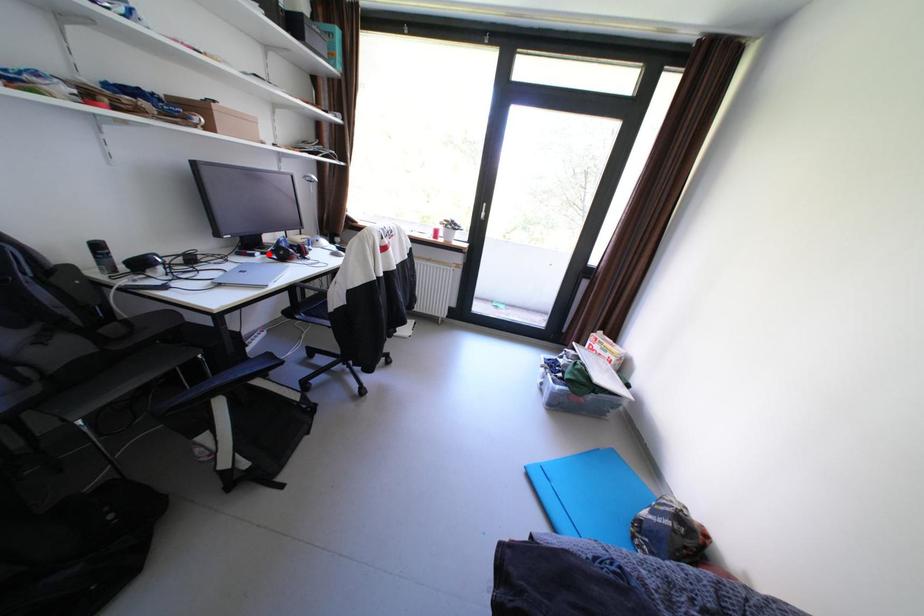
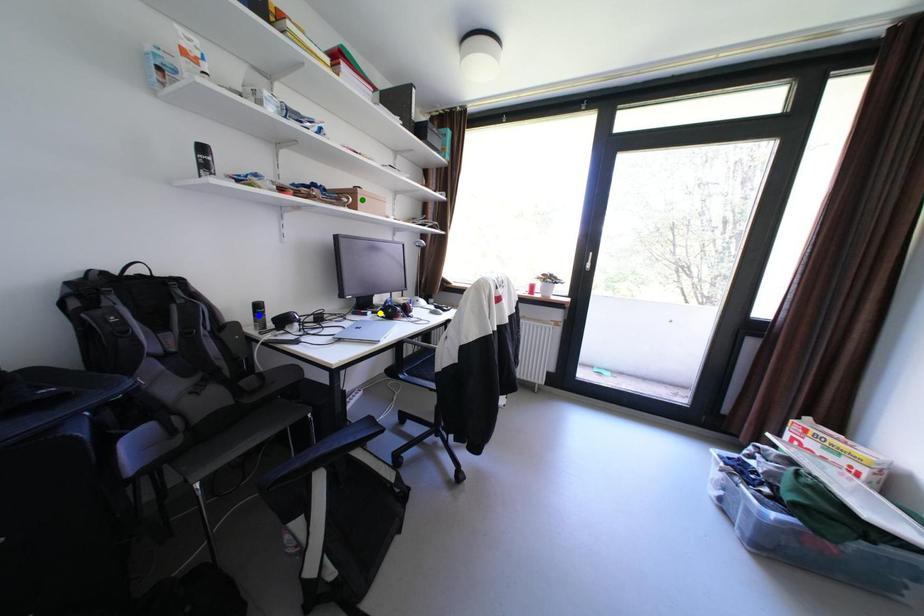
Question: I am providing you with two images of the same scene from different viewpoints. A red point is marked on the first image. You are given multiple points on the second image. In image 2, which mark is for the same physical point as the one in image 1?

Choices:
 (A) green point
 (B) yellow point
 (C) blue point

Answer: (B)